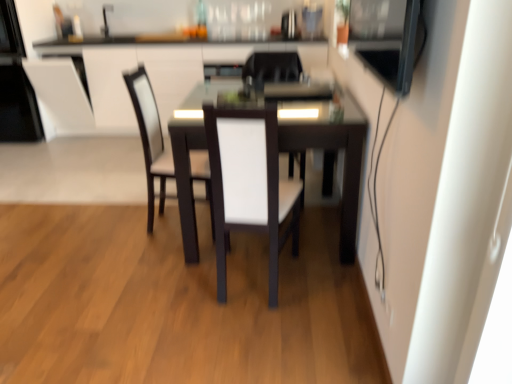
What are the coordinates of `vacant area that lies to the right of white fabric chair at center, marked as the first chair in a front-to-back arrangement` in the screenshot? It's located at (327, 287).